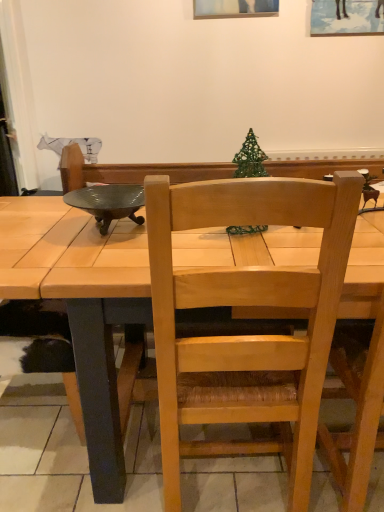
Question: Is light wood chair at center located outside metallic green bowl at upper left?

Choices:
 (A) no
 (B) yes

Answer: (B)

Question: From the image's perspective, is light wood chair at center over metallic green bowl at upper left?

Choices:
 (A) no
 (B) yes

Answer: (A)

Question: Does light wood chair at center have a smaller size compared to metallic green bowl at upper left?

Choices:
 (A) yes
 (B) no

Answer: (B)

Question: Is light wood chair at center shorter than metallic green bowl at upper left?

Choices:
 (A) no
 (B) yes

Answer: (A)

Question: From a real-world perspective, is light wood chair at center on metallic green bowl at upper left?

Choices:
 (A) yes
 (B) no

Answer: (B)

Question: Can metallic green bowl at upper left be found inside light wood chair at center?

Choices:
 (A) yes
 (B) no

Answer: (B)

Question: From a real-world perspective, is metallic green bowl at upper left on top of light wood chair at center?

Choices:
 (A) yes
 (B) no

Answer: (A)

Question: Would you say metallic green bowl at upper left is a long distance from light wood chair at center?

Choices:
 (A) no
 (B) yes

Answer: (A)

Question: Is metallic green bowl at upper left surrounding light wood chair at center?

Choices:
 (A) no
 (B) yes

Answer: (A)

Question: Is light wood chair at center at the back of metallic green bowl at upper left?

Choices:
 (A) no
 (B) yes

Answer: (A)

Question: Does metallic green bowl at upper left have a lesser height compared to light wood chair at center?

Choices:
 (A) yes
 (B) no

Answer: (A)

Question: Is metallic green bowl at upper left oriented towards light wood chair at center?

Choices:
 (A) no
 (B) yes

Answer: (A)

Question: From the image's perspective, relative to metallic green bowl at upper left, is light wood chair at center above or below?

Choices:
 (A) below
 (B) above

Answer: (A)